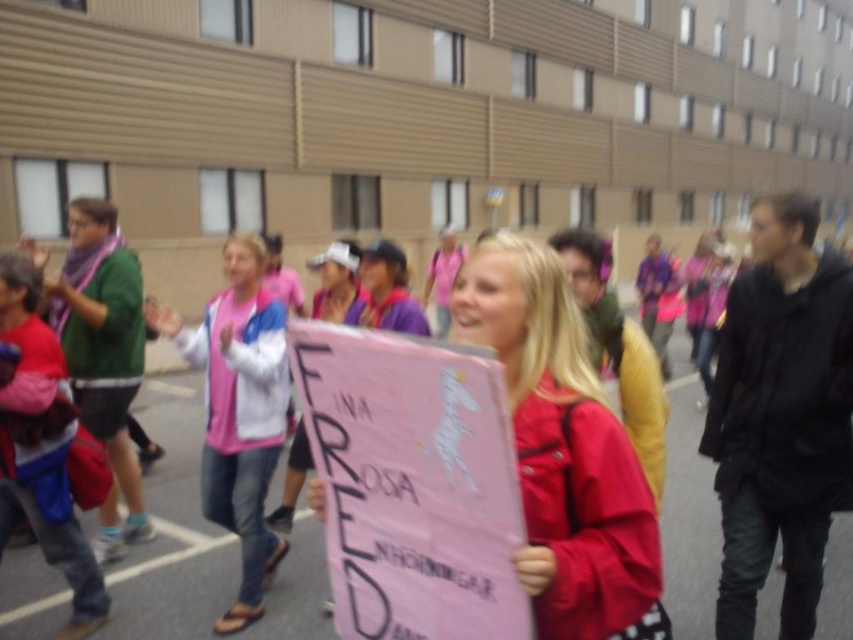
Question: Based on their relative distances, which object is farther from the pink paper sign at center?

Choices:
 (A) pink fabric jacket at center
 (B) matte pink sign at center

Answer: (A)

Question: Which of the following is the closest to the observer?

Choices:
 (A) pink paper sign at center
 (B) matte pink sign at center
 (C) pink fabric jacket at center

Answer: (A)

Question: Does pink paper sign at center lie in front of matte pink sign at center?

Choices:
 (A) no
 (B) yes

Answer: (B)

Question: Which of the following is the farthest from the observer?

Choices:
 (A) matte pink sign at center
 (B) pink fabric jacket at center

Answer: (B)

Question: Is pink paper sign at center in front of pink fabric jacket at center?

Choices:
 (A) yes
 (B) no

Answer: (A)

Question: Is matte pink sign at center positioned before pink fabric jacket at center?

Choices:
 (A) no
 (B) yes

Answer: (B)